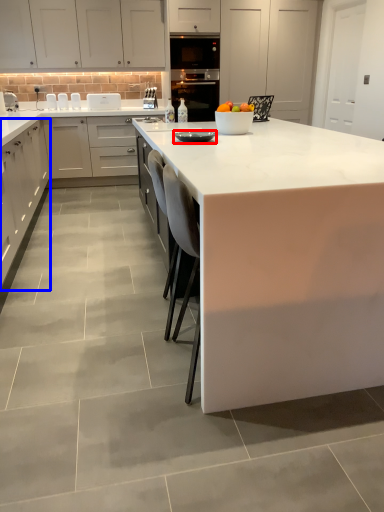
Question: Which object is further to the camera taking this photo, appliance (highlighted by a red box) or cabinetry (highlighted by a blue box)?

Choices:
 (A) appliance
 (B) cabinetry

Answer: (B)